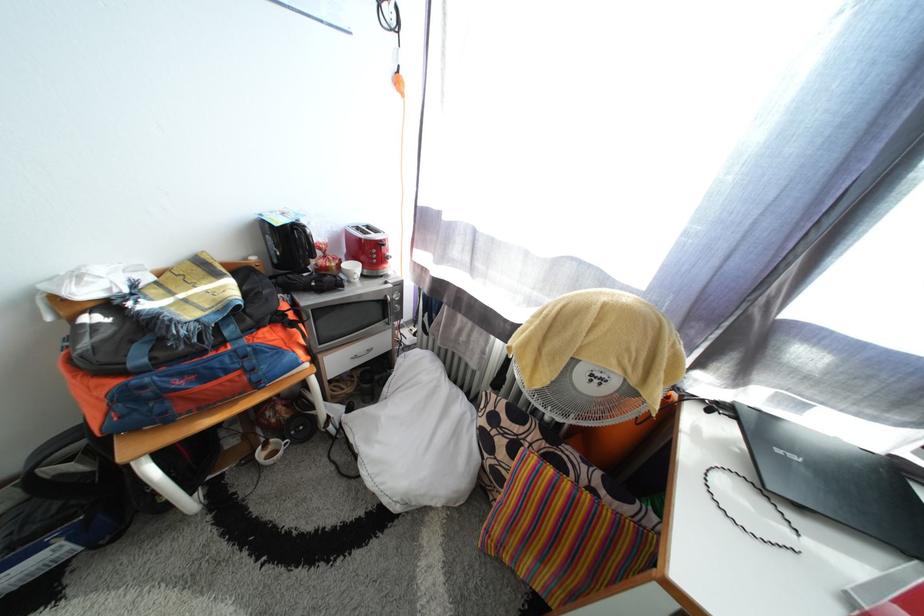
Where is `microwave door handle`? microwave door handle is located at coordinates (390, 310).